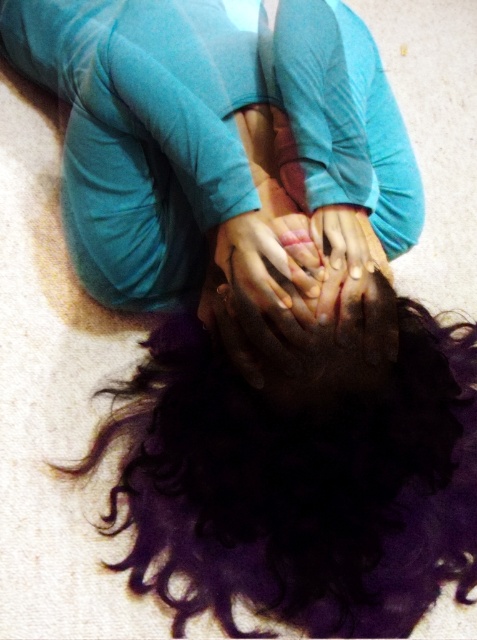
Is dark curly hair at center bigger than smooth skin hands at center?

Indeed, dark curly hair at center has a larger size compared to smooth skin hands at center.

The width and height of the screenshot is (477, 640). What are the coordinates of `dark curly hair at center` in the screenshot? It's located at (293, 467).